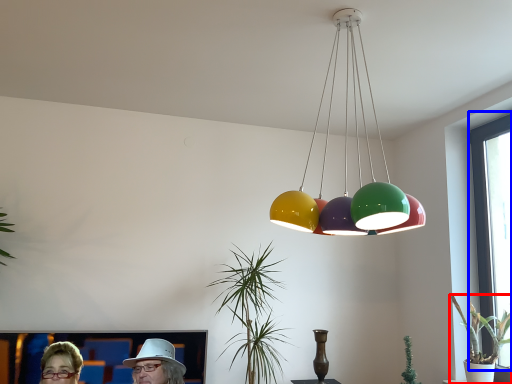
Question: Which object is closer to the camera taking this photo, houseplant (highlighted by a red box) or window screen (highlighted by a blue box)?

Choices:
 (A) houseplant
 (B) window screen

Answer: (A)